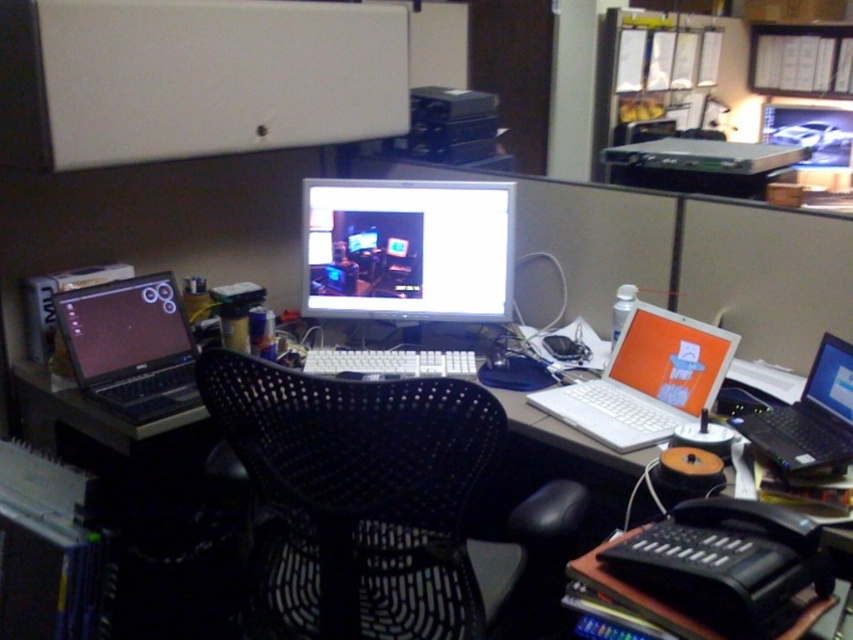
Is point (74, 433) farther from camera compared to point (827, 444)?

That is True.

Is point (589, 474) positioned behind point (833, 422)?

Yes.

Where is `white plastic computer desk at center`? Image resolution: width=853 pixels, height=640 pixels. white plastic computer desk at center is located at coordinates (111, 435).

Can you confirm if black mesh swivel chair at center is positioned to the left of white plastic computer desk at center?

Indeed, black mesh swivel chair at center is positioned on the left side of white plastic computer desk at center.

Is point (457, 586) farther from viewer compared to point (202, 433)?

No, it is not.

Where is `black mesh swivel chair at center`? This screenshot has height=640, width=853. black mesh swivel chair at center is located at coordinates (376, 504).

Is black mesh swivel chair at center to the right of white plastic laptop at right from the viewer's perspective?

No, black mesh swivel chair at center is not to the right of white plastic laptop at right.

Between point (338, 445) and point (846, 394), which one is positioned behind?

The point (846, 394) is behind.

The width and height of the screenshot is (853, 640). What are the coordinates of `black mesh swivel chair at center` in the screenshot? It's located at (376, 504).